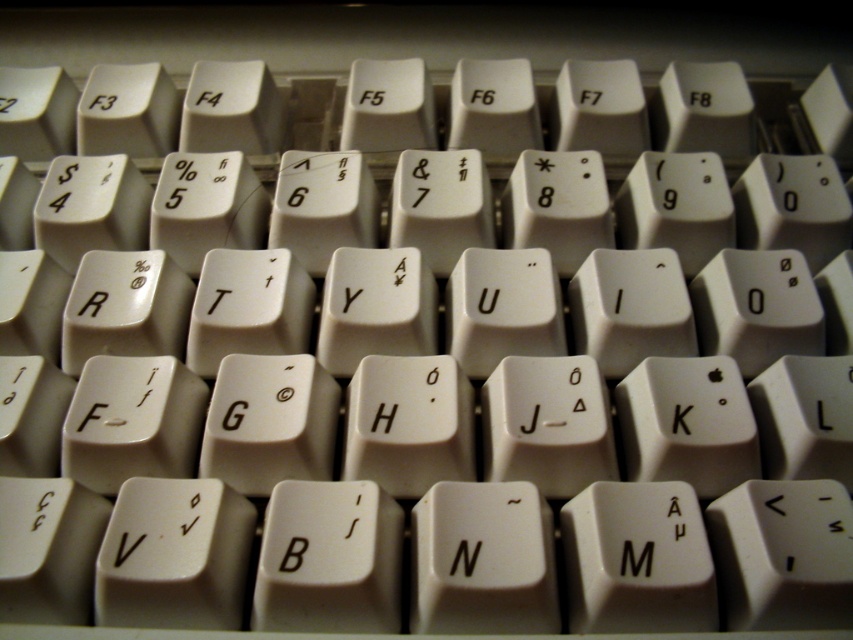
Question: Which point is farther to the camera?

Choices:
 (A) (386, 417)
 (B) (462, 544)
 (C) (622, 572)

Answer: (A)

Question: Which point is farther from the camera taking this photo?

Choices:
 (A) (469, 572)
 (B) (631, 547)
 (C) (393, 403)

Answer: (C)

Question: Is the position of white plastic letter n at center more distant than that of white plastic letter h at center?

Choices:
 (A) yes
 (B) no

Answer: (B)

Question: Does white plastic letter m at center have a smaller size compared to white plastic letter n at center?

Choices:
 (A) no
 (B) yes

Answer: (A)

Question: Among these objects, which one is farthest from the camera?

Choices:
 (A) white plastic letter n at center
 (B) white plastic letter h at center

Answer: (B)

Question: Considering the relative positions of white plastic letter m at center and white plastic letter n at center in the image provided, where is white plastic letter m at center located with respect to white plastic letter n at center?

Choices:
 (A) below
 (B) above

Answer: (A)